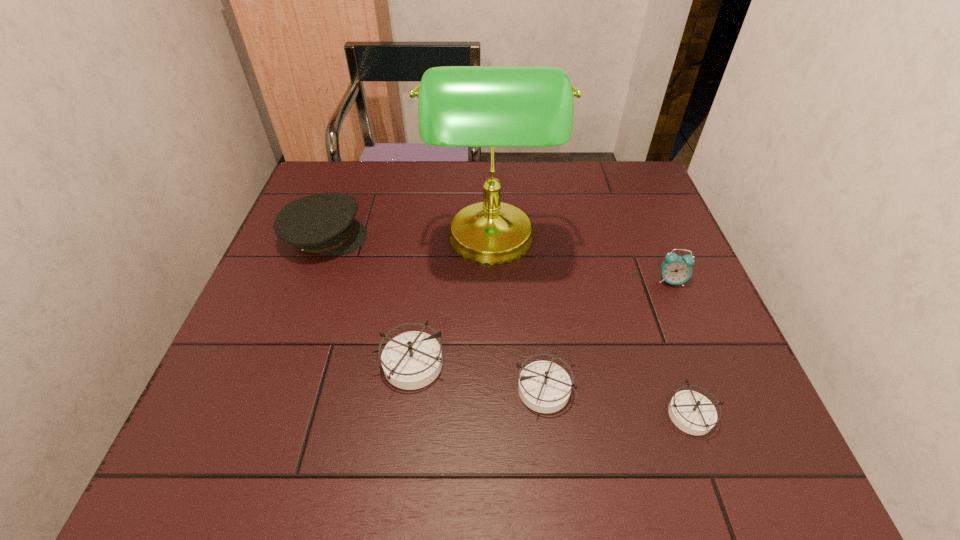
Locate an element on the screen. This screenshot has height=540, width=960. vacant space that satisfies the following two spatial constraints: 1. on the back side of the second compass from right to left; 2. on the front-facing side of the beret is located at coordinates (527, 237).

This screenshot has height=540, width=960. I want to click on vacant point that satisfies the following two spatial constraints: 1. on the desk next to the second tallest compass; 2. on the right side of the tallest object, so click(x=495, y=388).

This screenshot has height=540, width=960. What are the coordinates of `free space that satisfies the following two spatial constraints: 1. on the front-facing side of the leftmost object; 2. on the back side of the leftmost compass` in the screenshot? It's located at (277, 364).

The height and width of the screenshot is (540, 960). I want to click on free space that satisfies the following two spatial constraints: 1. on the back side of the rightmost compass; 2. on the desk next to the lamp, so click(x=630, y=242).

The height and width of the screenshot is (540, 960). Identify the location of vacant region that satisfies the following two spatial constraints: 1. on the desk next to the second shortest object; 2. on the left side of the tallest object. (495, 388).

You are a GUI agent. You are given a task and a screenshot of the screen. Output one action in this format:
    pyautogui.click(x=<x>, y=<y>)
    Task: Click on the free space in the image that satisfies the following two spatial constraints: 1. on the front-facing side of the leftmost object; 2. on the right side of the tallest compass
    Image resolution: width=960 pixels, height=540 pixels.
    Given the screenshot: What is the action you would take?
    pyautogui.click(x=277, y=364)

In order to click on vacant space that satisfies the following two spatial constraints: 1. on the desk next to the tallest object; 2. on the left side of the shortest compass in this screenshot , I will do `click(495, 414)`.

Where is `vacant space that satisfies the following two spatial constraints: 1. on the desk next to the second compass from right to left; 2. on the right side of the lamp`? The width and height of the screenshot is (960, 540). vacant space that satisfies the following two spatial constraints: 1. on the desk next to the second compass from right to left; 2. on the right side of the lamp is located at coordinates (495, 388).